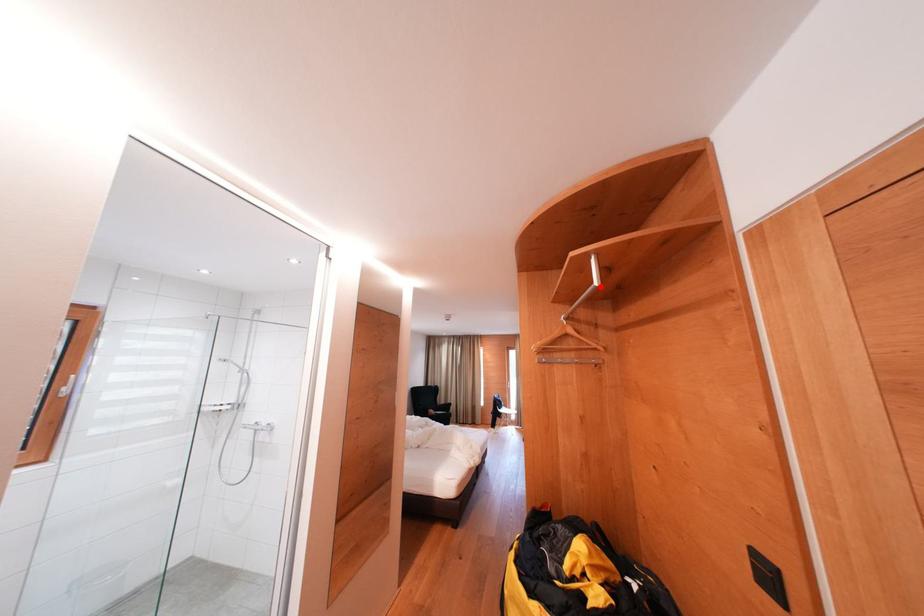
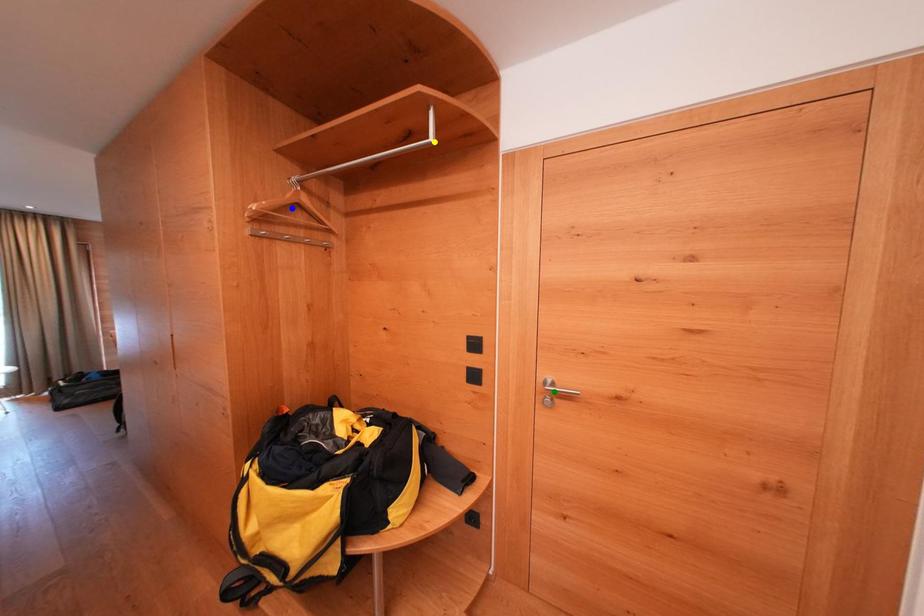
Question: I am providing you with two images of the same scene from different viewpoints. A red point is marked on the first image. You are given multiple points on the second image. Which point in image 2 is actually the same real-world point as the red point in image 1?

Choices:
 (A) green point
 (B) blue point
 (C) yellow point

Answer: (C)